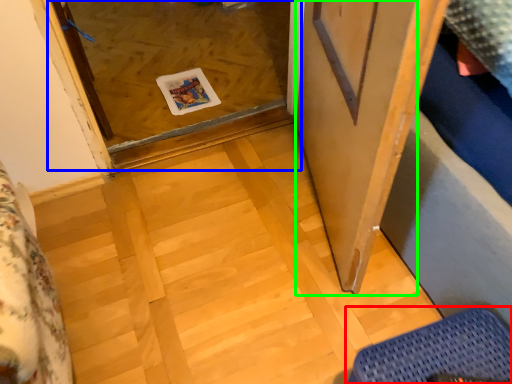
Question: Based on their relative distances, which object is nearer to furniture (highlighted by a red box)? Choose from glass door (highlighted by a blue box) and screen door (highlighted by a green box).

Choices:
 (A) glass door
 (B) screen door

Answer: (B)